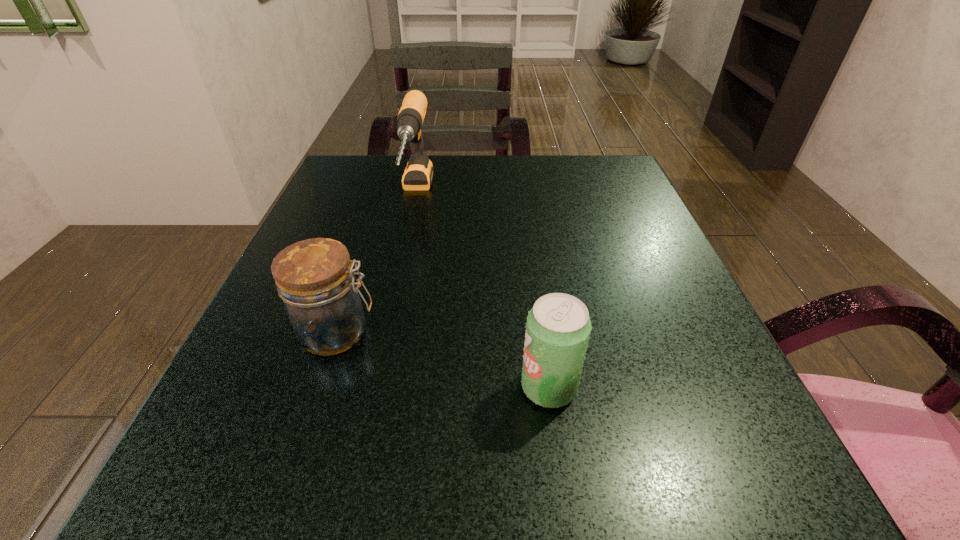
At what (x,y) coordinates should I click in order to perform the action: click on free space that satisfies the following two spatial constraints: 1. on the handle side of the farthest object; 2. on the lid of the jar. Please return your answer as a coordinate pair (x, y). Looking at the image, I should click on (387, 333).

At what (x,y) coordinates should I click in order to perform the action: click on free space that satisfies the following two spatial constraints: 1. on the handle side of the tallest object; 2. on the lid of the second farthest object. Please return your answer as a coordinate pair (x, y). The height and width of the screenshot is (540, 960). Looking at the image, I should click on (387, 333).

At what (x,y) coordinates should I click in order to perform the action: click on free space that satisfies the following two spatial constraints: 1. on the lid of the nearest object; 2. on the left side of the jar. Please return your answer as a coordinate pair (x, y). Looking at the image, I should click on (320, 387).

Where is `vacant space that satisfies the following two spatial constraints: 1. on the back side of the nearest object; 2. on the lid of the second farthest object`? The height and width of the screenshot is (540, 960). vacant space that satisfies the following two spatial constraints: 1. on the back side of the nearest object; 2. on the lid of the second farthest object is located at coordinates (541, 333).